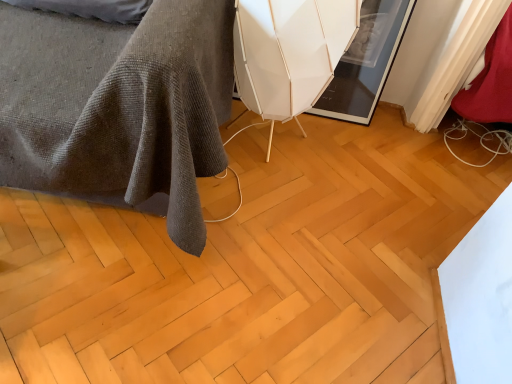
Question: Does dark gray textured blanket at lower left turn towards natural wood floor at center?

Choices:
 (A) no
 (B) yes

Answer: (A)

Question: Does dark gray textured blanket at lower left lie behind natural wood floor at center?

Choices:
 (A) no
 (B) yes

Answer: (A)

Question: Does dark gray textured blanket at lower left have a lesser width compared to natural wood floor at center?

Choices:
 (A) yes
 (B) no

Answer: (A)

Question: From a real-world perspective, is dark gray textured blanket at lower left below natural wood floor at center?

Choices:
 (A) no
 (B) yes

Answer: (A)

Question: Is dark gray textured blanket at lower left beside natural wood floor at center?

Choices:
 (A) yes
 (B) no

Answer: (B)

Question: Does dark gray textured blanket at lower left have a lesser height compared to natural wood floor at center?

Choices:
 (A) no
 (B) yes

Answer: (A)

Question: Is natural wood floor at center turned away from dark gray textured blanket at lower left?

Choices:
 (A) yes
 (B) no

Answer: (B)

Question: Is natural wood floor at center behind dark gray textured blanket at lower left?

Choices:
 (A) no
 (B) yes

Answer: (B)

Question: Can you confirm if natural wood floor at center is thinner than dark gray textured blanket at lower left?

Choices:
 (A) no
 (B) yes

Answer: (A)

Question: Does natural wood floor at center have a smaller size compared to dark gray textured blanket at lower left?

Choices:
 (A) yes
 (B) no

Answer: (A)

Question: Is natural wood floor at center outside of dark gray textured blanket at lower left?

Choices:
 (A) yes
 (B) no

Answer: (A)

Question: Can you confirm if natural wood floor at center is bigger than dark gray textured blanket at lower left?

Choices:
 (A) no
 (B) yes

Answer: (A)

Question: Is natural wood floor at center turned away from white matte swivel chair at center?

Choices:
 (A) no
 (B) yes

Answer: (A)